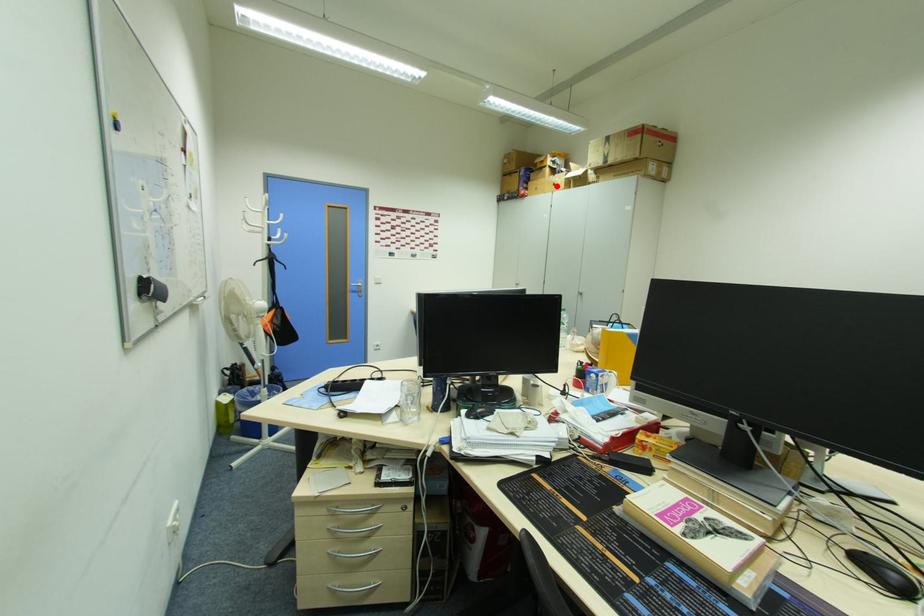
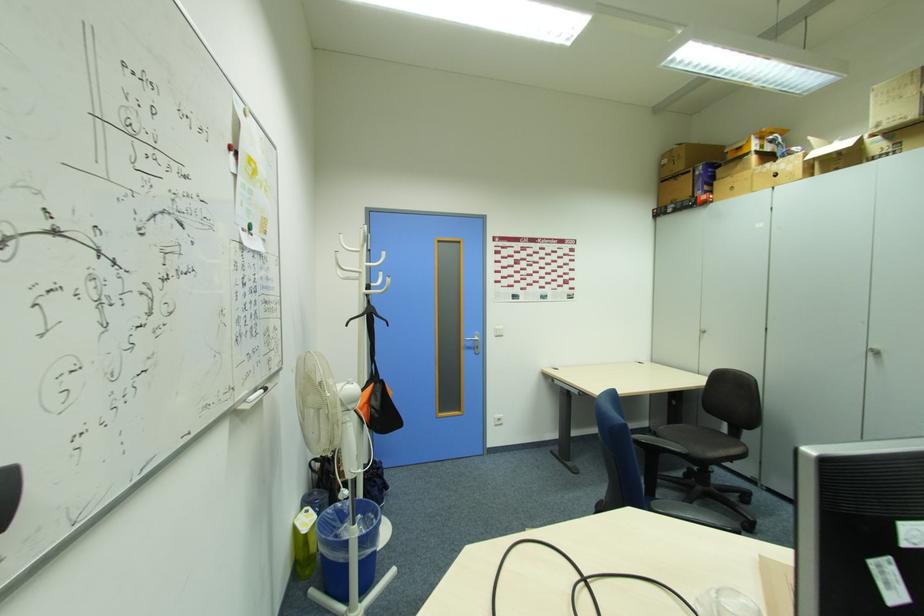
Question: I am providing you with two images of the same scene from different viewpoints. Image1 has a red point marked. In image2, the corresponding 3D location appears at what relative position? Reply with the corresponding letter.

Choices:
 (A) Closer
 (B) Farther

Answer: (B)